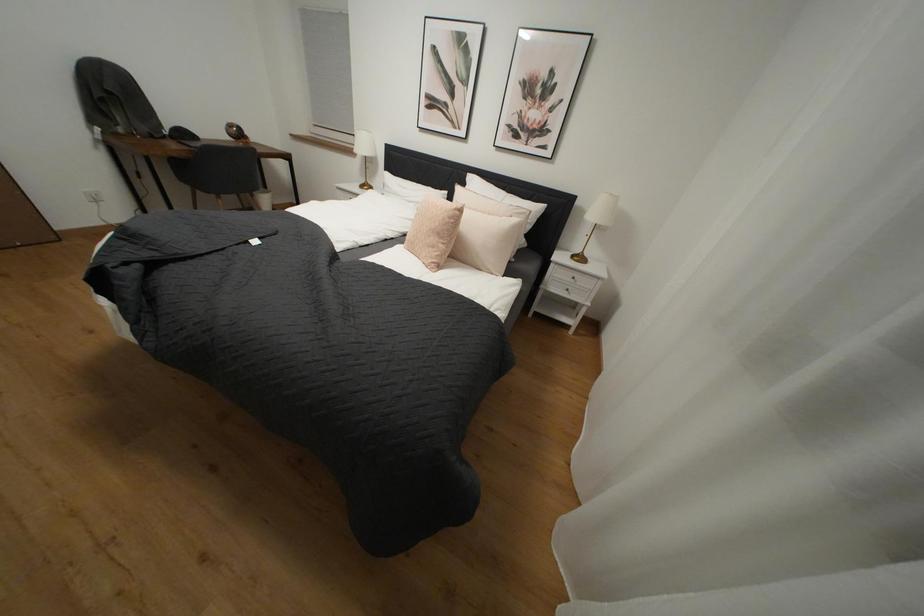
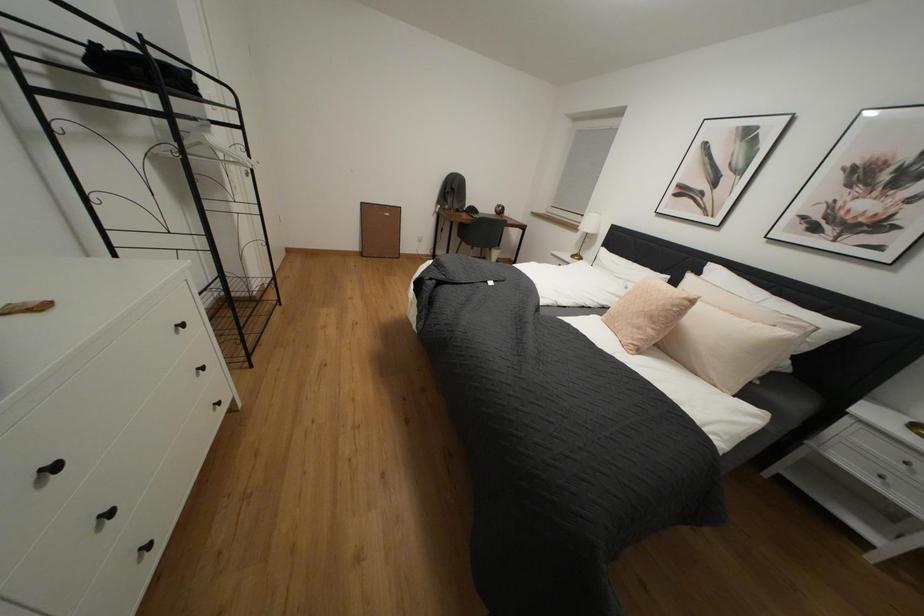
Question: The first image is from the beginning of the video and the second image is from the end. How did the camera likely rotate when shooting the video?

Choices:
 (A) Left
 (B) Right
 (C) Up
 (D) Down

Answer: (A)